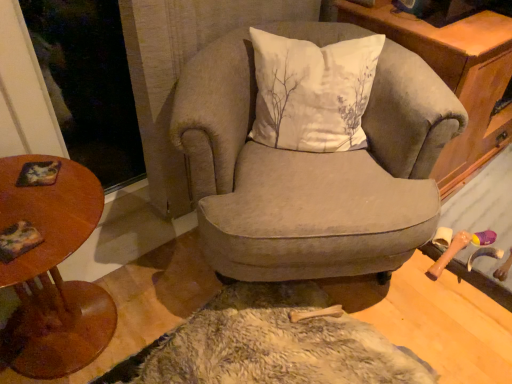
Question: Does wooden cabinet at upper right touch white cotton cushion at center?

Choices:
 (A) no
 (B) yes

Answer: (A)

Question: Is white cotton cushion at center surrounded by wooden cabinet at upper right?

Choices:
 (A) no
 (B) yes

Answer: (A)

Question: Does wooden cabinet at upper right have a larger size compared to white cotton cushion at center?

Choices:
 (A) no
 (B) yes

Answer: (B)

Question: Is wooden cabinet at upper right thinner than white cotton cushion at center?

Choices:
 (A) no
 (B) yes

Answer: (A)

Question: Is white cotton cushion at center at the back of wooden cabinet at upper right?

Choices:
 (A) no
 (B) yes

Answer: (A)

Question: Considering the relative sizes of wooden cabinet at upper right and white cotton cushion at center in the image provided, is wooden cabinet at upper right shorter than white cotton cushion at center?

Choices:
 (A) no
 (B) yes

Answer: (A)

Question: Is wooden cabinet at upper right positioned with its back to velvet gray armchair at center?

Choices:
 (A) yes
 (B) no

Answer: (B)

Question: From a real-world perspective, is wooden cabinet at upper right positioned under velvet gray armchair at center based on gravity?

Choices:
 (A) no
 (B) yes

Answer: (A)

Question: Is the depth of wooden cabinet at upper right greater than that of velvet gray armchair at center?

Choices:
 (A) yes
 (B) no

Answer: (A)

Question: Does wooden cabinet at upper right have a larger size compared to velvet gray armchair at center?

Choices:
 (A) no
 (B) yes

Answer: (B)

Question: Can you confirm if wooden cabinet at upper right is taller than velvet gray armchair at center?

Choices:
 (A) yes
 (B) no

Answer: (A)

Question: From a real-world perspective, is wooden cabinet at upper right on top of velvet gray armchair at center?

Choices:
 (A) no
 (B) yes

Answer: (B)

Question: Can you confirm if velvet gray armchair at center is bigger than wooden round table at left?

Choices:
 (A) no
 (B) yes

Answer: (B)